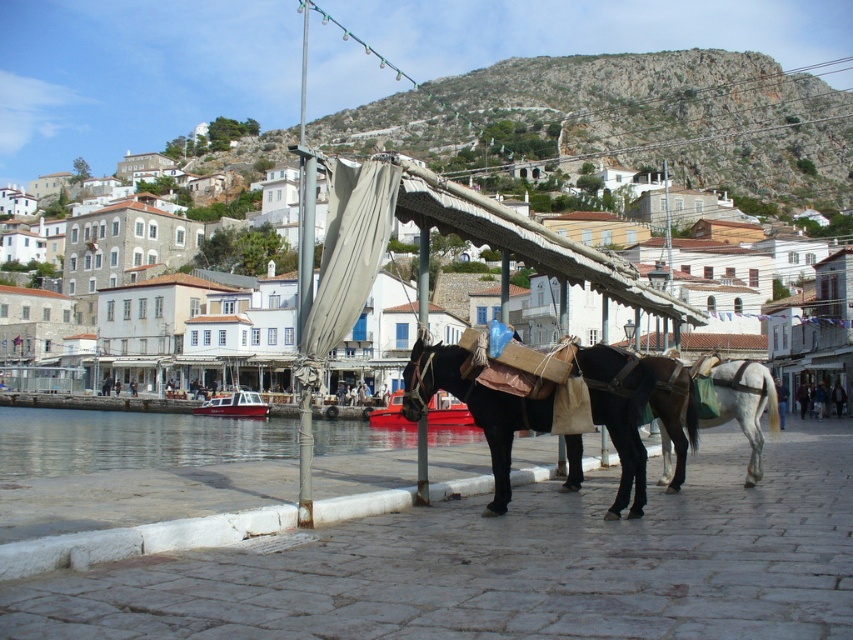
Is white matte building at center above white fabric canopy at center?

Yes.

Based on the photo, how far apart are white matte building at center and white fabric canopy at center?

white matte building at center and white fabric canopy at center are 195.77 meters apart from each other.

The image size is (853, 640). Describe the element at coordinates (625, 124) in the screenshot. I see `white matte building at center` at that location.

This screenshot has width=853, height=640. I want to click on white matte building at center, so click(625, 124).

At what (x,y) coordinates should I click in order to perform the action: click on black glossy horse at center. Please return your answer as a coordinate pair (x, y). Looking at the image, I should click on (637, 412).

Which is in front, point (579, 486) or point (466, 412)?

Point (579, 486)

Identify the location of black glossy horse at center. (637, 412).

Between white matte building at center and white glossy horse at right, which one appears on the left side from the viewer's perspective?

Positioned to the left is white glossy horse at right.

Is white matte building at center wider than white glossy horse at right?

Indeed, white matte building at center has a greater width compared to white glossy horse at right.

Who is more distant from viewer, (274,150) or (751,484)?

Point (274,150)

This screenshot has height=640, width=853. What are the coordinates of `white matte building at center` in the screenshot? It's located at (625, 124).